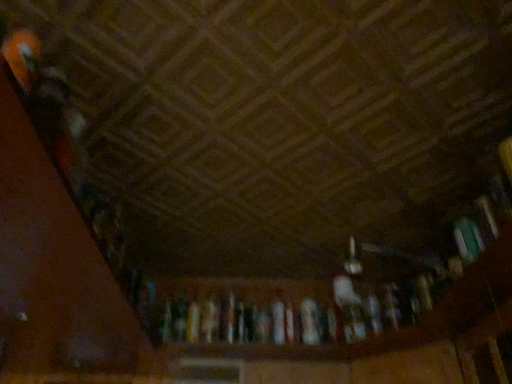
Describe the element at coordinates (475, 230) in the screenshot. I see `teal matte book at right, which is counted as the 1th book, starting from the right` at that location.

Measure the distance between point (488, 228) and camera.

Point (488, 228) is 1.00 meters away from camera.

Locate an element on the screen. The image size is (512, 384). teal matte book at right, the 2th book in the left-to-right sequence is located at coordinates (475, 230).

In the scene shown: Measure the distance between point (308, 339) and camera.

They are 5.10 feet apart.

Where is `white paper book at center, arranged as the first book when ordered from the bottom`? Image resolution: width=512 pixels, height=384 pixels. white paper book at center, arranged as the first book when ordered from the bottom is located at coordinates (310, 321).

The height and width of the screenshot is (384, 512). Describe the element at coordinates (310, 321) in the screenshot. I see `white paper book at center, which is counted as the 1th book, starting from the back` at that location.

Image resolution: width=512 pixels, height=384 pixels. I want to click on teal matte book at right, which appears as the 1th book when viewed from the top, so click(x=475, y=230).

Consider the image. Which object is positioned more to the right, white paper book at center, which is counted as the 2th book, starting from the right, or teal matte book at right, the 2th book positioned from the back?

teal matte book at right, the 2th book positioned from the back, is more to the right.

In the scene shown: Between white paper book at center, the first book viewed from the left, and teal matte book at right, which is counted as the 1th book, starting from the right, which one is positioned behind?

Positioned behind is white paper book at center, the first book viewed from the left.

Which point is more forward, (319, 325) or (473, 227)?

The point (473, 227) is more forward.

From the image's perspective, is white paper book at center, which is counted as the 2th book, starting from the right, above teal matte book at right, which appears as the 1th book when viewed from the top?

Actually, white paper book at center, which is counted as the 2th book, starting from the right, appears below teal matte book at right, which appears as the 1th book when viewed from the top, in the image.

From a real-world perspective, is white paper book at center, which is counted as the 1th book, starting from the back, positioned over teal matte book at right, the 2th book positioned from the back, based on gravity?

No, from a real-world perspective, white paper book at center, which is counted as the 1th book, starting from the back, is not above teal matte book at right, the 2th book positioned from the back.

Does white paper book at center, the first book viewed from the left, have a lesser width compared to teal matte book at right, which appears as the 1th book when viewed from the top?

Indeed, white paper book at center, the first book viewed from the left, has a lesser width compared to teal matte book at right, which appears as the 1th book when viewed from the top.

In terms of height, does white paper book at center, which is counted as the 2th book, starting from the right, look taller or shorter compared to teal matte book at right, the 2th book in the left-to-right sequence?

In the image, white paper book at center, which is counted as the 2th book, starting from the right, appears to be shorter than teal matte book at right, the 2th book in the left-to-right sequence.

Is white paper book at center, which is counted as the 2th book, starting from the right, bigger than teal matte book at right, which appears as the 1th book when viewed from the front?

No.

Choose the correct answer: Is white paper book at center, which is counted as the 1th book, starting from the back, inside teal matte book at right, which appears as the 1th book when viewed from the top, or outside it?

white paper book at center, which is counted as the 1th book, starting from the back, is not enclosed by teal matte book at right, which appears as the 1th book when viewed from the top.

Is white paper book at center, which is counted as the 1th book, starting from the back, facing towards teal matte book at right, which is counted as the 1th book, starting from the right?

No, white paper book at center, which is counted as the 1th book, starting from the back, does not turn towards teal matte book at right, which is counted as the 1th book, starting from the right.

How far apart are white paper book at center, which is counted as the second book, starting from the front, and teal matte book at right, which is counted as the 1th book, starting from the right?

The distance of white paper book at center, which is counted as the second book, starting from the front, from teal matte book at right, which is counted as the 1th book, starting from the right, is 27.03 inches.

In the image, there is a teal matte book at right, which appears as the 1th book when viewed from the top. At what (x,y) coordinates should I click in order to perform the action: click on book below it (from the image's perspective). Please return your answer as a coordinate pair (x, y). The image size is (512, 384). Looking at the image, I should click on (310, 321).

Considering the positions of objects teal matte book at right, which appears as the 1th book when viewed from the top, and white paper book at center, which is counted as the 2th book, starting from the right, in the image provided, who is more to the left, teal matte book at right, which appears as the 1th book when viewed from the top, or white paper book at center, which is counted as the 2th book, starting from the right,?

white paper book at center, which is counted as the 2th book, starting from the right, is more to the left.

From the picture: Is teal matte book at right, which appears as the 1th book when viewed from the front, positioned behind white paper book at center, which is counted as the 2th book, starting from the right?

No, teal matte book at right, which appears as the 1th book when viewed from the front, is closer to the camera.

Which point is more distant from viewer, (x=495, y=232) or (x=318, y=329)?

The point (x=318, y=329) is farther from the camera.

From the image's perspective, would you say teal matte book at right, the 2th book in the left-to-right sequence, is positioned over white paper book at center, which is counted as the second book, starting from the front?

Indeed, from the image's perspective, teal matte book at right, the 2th book in the left-to-right sequence, is shown above white paper book at center, which is counted as the second book, starting from the front.

From a real-world perspective, is teal matte book at right, which is counted as the 1th book, starting from the right, under white paper book at center, the first book viewed from the left?

Actually, teal matte book at right, which is counted as the 1th book, starting from the right, is physically above white paper book at center, the first book viewed from the left, in the real world.

Between teal matte book at right, which appears as the 1th book when viewed from the front, and white paper book at center, which is counted as the second book, starting from the front, which one has smaller width?

With smaller width is white paper book at center, which is counted as the second book, starting from the front.

Does teal matte book at right, which appears as the 1th book when viewed from the top, have a greater height compared to white paper book at center, arranged as the first book when ordered from the bottom?

Yes, teal matte book at right, which appears as the 1th book when viewed from the top, is taller than white paper book at center, arranged as the first book when ordered from the bottom.

Who is smaller, teal matte book at right, the 2th book in the left-to-right sequence, or white paper book at center, the first book viewed from the left?

white paper book at center, the first book viewed from the left, is smaller.

From the picture: Can we say teal matte book at right, the 2th book positioned from the back, lies outside white paper book at center, the first book viewed from the left?

Absolutely, teal matte book at right, the 2th book positioned from the back, is external to white paper book at center, the first book viewed from the left.

Is teal matte book at right, the 2th book in the left-to-right sequence, next to white paper book at center, which is counted as the 2th book, starting from the right?

No.

Could you tell me if teal matte book at right, which appears as the 1th book when viewed from the top, is facing white paper book at center, arranged as the first book when ordered from the bottom?

No, teal matte book at right, which appears as the 1th book when viewed from the top, is not turned towards white paper book at center, arranged as the first book when ordered from the bottom.

You are a GUI agent. You are given a task and a screenshot of the screen. Output one action in this format:
    pyautogui.click(x=<x>, y=<y>)
    Task: Click on the book in front of the white paper book at center, which is counted as the second book, starting from the front
    
    Given the screenshot: What is the action you would take?
    pyautogui.click(x=475, y=230)

Locate an element on the screen. The width and height of the screenshot is (512, 384). book that is above the white paper book at center, the first book viewed from the left (from a real-world perspective) is located at coordinates (475, 230).

What are the coordinates of `book on the left of teal matte book at right, which is the second book in bottom-to-top order` in the screenshot? It's located at point(310,321).